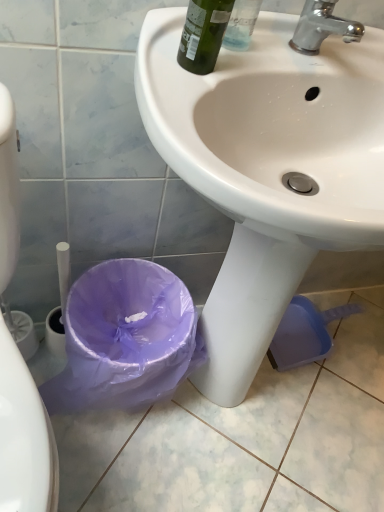
The height and width of the screenshot is (512, 384). Identify the location of vacant area that lies between green glass bottle at upper center and chrome metallic faucet at upper right. (253, 60).